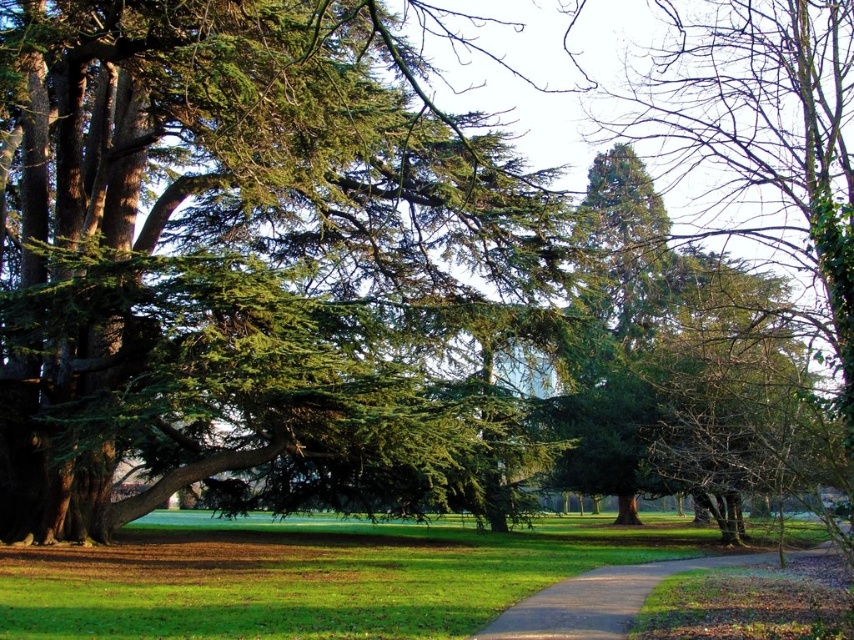
Question: Among these objects, which one is nearest to the camera?

Choices:
 (A) brown gravel path at center
 (B) green needle-like foliage at center

Answer: (B)

Question: Considering the relative positions of green needle-like foliage at center and green grass at center in the image provided, where is green needle-like foliage at center located with respect to green grass at center?

Choices:
 (A) left
 (B) right

Answer: (A)

Question: Does green needle-like foliage at center have a greater width compared to brown gravel path at center?

Choices:
 (A) yes
 (B) no

Answer: (A)

Question: Among these points, which one is farthest from the camera?

Choices:
 (A) (382, 592)
 (B) (211, 456)
 (C) (575, 625)

Answer: (B)

Question: Among these points, which one is farthest from the camera?

Choices:
 (A) (22, 160)
 (B) (219, 573)

Answer: (A)

Question: Does green grass at center appear under brown gravel path at center?

Choices:
 (A) yes
 (B) no

Answer: (A)